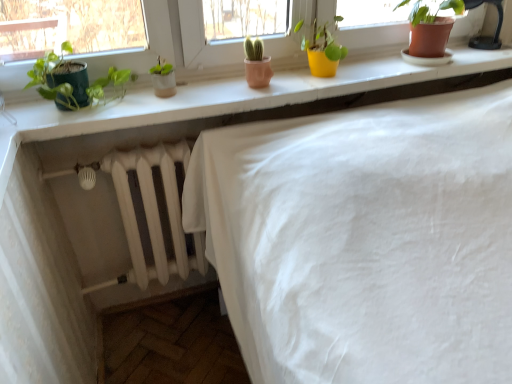
Identify the location of vacant space positioned to the left of terracotta clay pot at upper right, arranged as the 3th houseplant when viewed from the left. click(x=373, y=64).